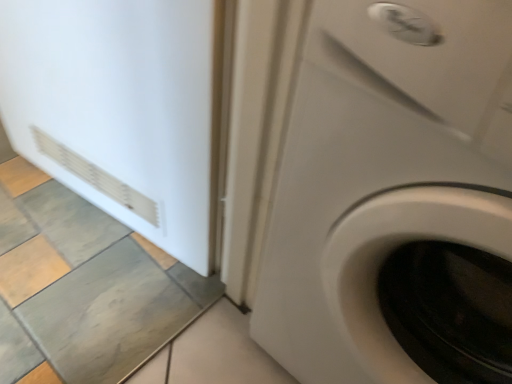
The width and height of the screenshot is (512, 384). Describe the element at coordinates (394, 198) in the screenshot. I see `white glossy washing machine at center` at that location.

The image size is (512, 384). I want to click on white glossy washing machine at center, so click(394, 198).

At what (x,y) coordinates should I click in order to perform the action: click on white matte refrigerator at left. Please return your answer as a coordinate pair (x, y). The width and height of the screenshot is (512, 384). Looking at the image, I should click on (120, 108).

What is the approximate width of white matte refrigerator at left?

white matte refrigerator at left is 3.70 inches wide.

What do you see at coordinates (120, 108) in the screenshot? Image resolution: width=512 pixels, height=384 pixels. I see `white matte refrigerator at left` at bounding box center [120, 108].

Locate an element on the screen. The image size is (512, 384). white glossy washing machine at center is located at coordinates (394, 198).

Which object is positioned more to the right, white matte refrigerator at left or white glossy washing machine at center?

white glossy washing machine at center is more to the right.

Who is more distant, white matte refrigerator at left or white glossy washing machine at center?

white matte refrigerator at left.

Considering the points (69, 162) and (318, 107), which point is in front, point (69, 162) or point (318, 107)?

The point (318, 107) is closer.

From the image's perspective, which object appears higher, white matte refrigerator at left or white glossy washing machine at center?

white matte refrigerator at left, from the image's perspective.

From a real-world perspective, is white matte refrigerator at left physically above white glossy washing machine at center?

No, from a real-world perspective, white matte refrigerator at left is not over white glossy washing machine at center

Considering the sizes of objects white matte refrigerator at left and white glossy washing machine at center in the image provided, who is wider, white matte refrigerator at left or white glossy washing machine at center?

Wider between the two is white glossy washing machine at center.

Is white matte refrigerator at left shorter than white glossy washing machine at center?

Indeed, white matte refrigerator at left has a lesser height compared to white glossy washing machine at center.

Consider the image. Can you confirm if white matte refrigerator at left is smaller than white glossy washing machine at center?

Yes, white matte refrigerator at left is smaller than white glossy washing machine at center.

Could white glossy washing machine at center be considered to be inside white matte refrigerator at left?

That's incorrect, white glossy washing machine at center is not inside white matte refrigerator at left.

Is white matte refrigerator at left placed right next to white glossy washing machine at center?

No, white matte refrigerator at left is not next to white glossy washing machine at center.

Is white matte refrigerator at left turned away from white glossy washing machine at center?

white matte refrigerator at left is not turned away from white glossy washing machine at center.

How many degrees apart are the facing directions of white matte refrigerator at left and white glossy washing machine at center?

The facing directions of white matte refrigerator at left and white glossy washing machine at center are 9.19 degrees apart.

I want to click on washing machine located on the right of white matte refrigerator at left, so click(x=394, y=198).

Which is more to the right, white glossy washing machine at center or white matte refrigerator at left?

white glossy washing machine at center.

Is the position of white glossy washing machine at center less distant than that of white matte refrigerator at left?

Yes, the depth of white glossy washing machine at center is less than that of white matte refrigerator at left.

Which is closer to the camera, (460, 290) or (3, 13)?

The point (460, 290) is more forward.

Consider the image. From the image's perspective, is white glossy washing machine at center above white matte refrigerator at left?

No, from the image's perspective, white glossy washing machine at center is not on top of white matte refrigerator at left.

From a real-world perspective, which is physically below, white glossy washing machine at center or white matte refrigerator at left?

white matte refrigerator at left, from a real-world perspective.

Which of these two, white glossy washing machine at center or white matte refrigerator at left, is wider?

With larger width is white glossy washing machine at center.

Is white glossy washing machine at center taller or shorter than white matte refrigerator at left?

white glossy washing machine at center is taller than white matte refrigerator at left.

Which of these two, white glossy washing machine at center or white matte refrigerator at left, is smaller?

Smaller between the two is white matte refrigerator at left.

Choose the correct answer: Is white glossy washing machine at center inside white matte refrigerator at left or outside it?

white glossy washing machine at center is located beyond the bounds of white matte refrigerator at left.

Consider the image. Are white glossy washing machine at center and white matte refrigerator at left beside each other?

No, white glossy washing machine at center is not next to white matte refrigerator at left.

Is white glossy washing machine at center looking in the opposite direction of white matte refrigerator at left?

No, white glossy washing machine at center is not facing the opposite direction of white matte refrigerator at left.

This screenshot has width=512, height=384. I want to click on screen door that appears above the white glossy washing machine at center (from the image's perspective), so click(x=120, y=108).

Locate an element on the screen. The height and width of the screenshot is (384, 512). washing machine located above the white matte refrigerator at left (from a real-world perspective) is located at coordinates coord(394,198).

The width and height of the screenshot is (512, 384). What are the coordinates of `washing machine in front of the white matte refrigerator at left` in the screenshot? It's located at (394, 198).